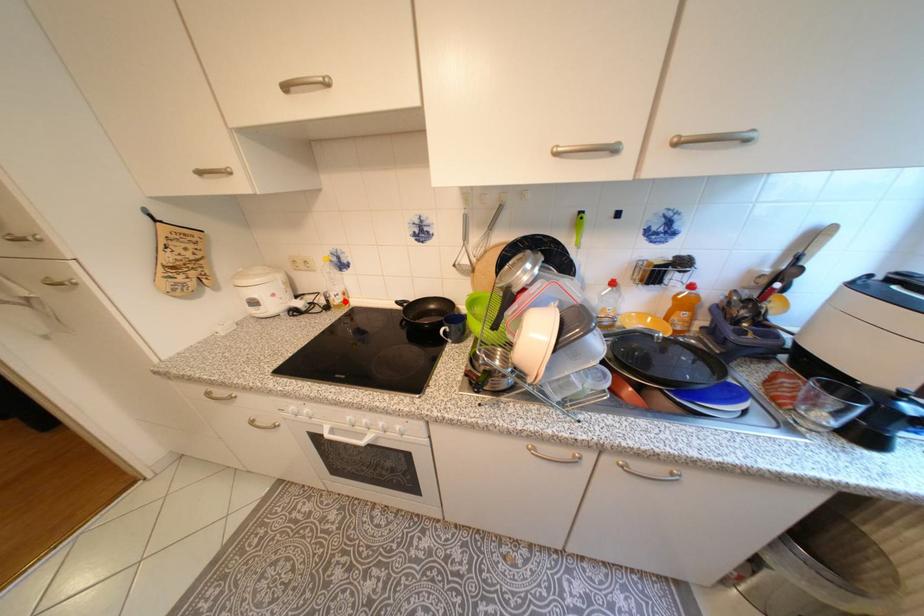
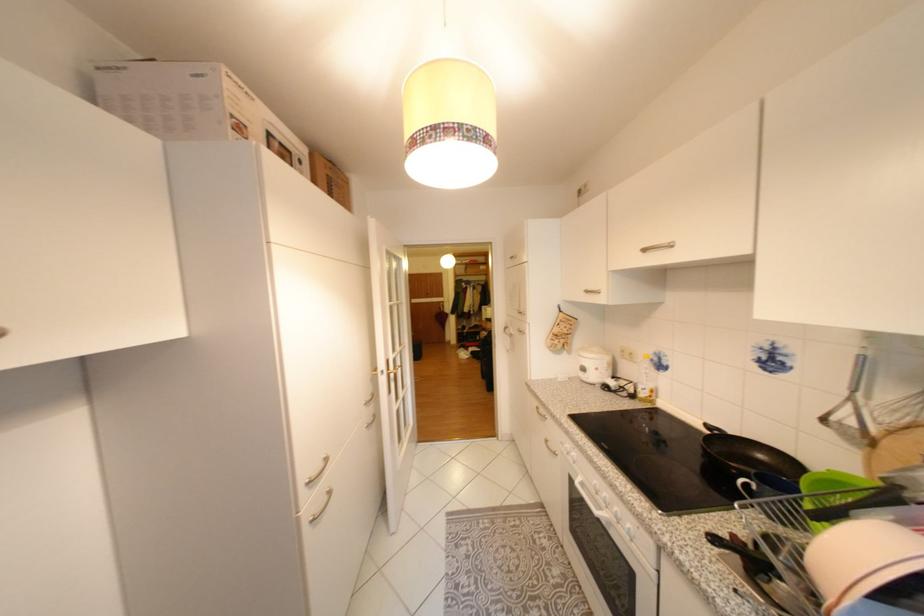
Question: I am providing you with two images of the same scene from different viewpoints. A red point is marked on the first image. At the location where the point appears in image 1, is it still visible in image 2?

Choices:
 (A) Yes
 (B) No

Answer: (A)